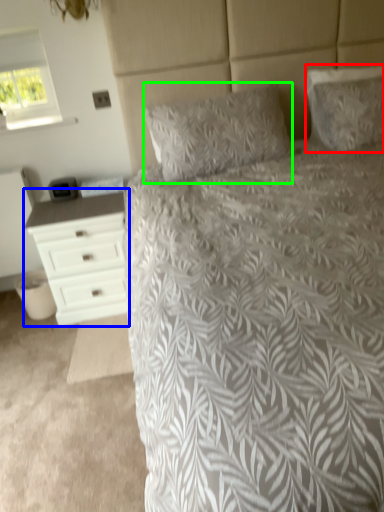
Question: Considering the real-world distances, which object is closest to pillow (highlighted by a red box)? chest of drawers (highlighted by a blue box) or pillow (highlighted by a green box).

Choices:
 (A) chest of drawers
 (B) pillow

Answer: (B)